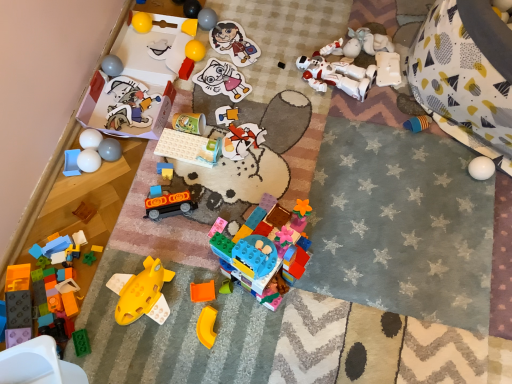
Locate an element on the screen. vacant area that lies between matte paper sticker at center, the eighteenth toy positioned from the left, and smooth yellow ball at upper center, the ninth toy from the right is located at coordinates (218, 55).